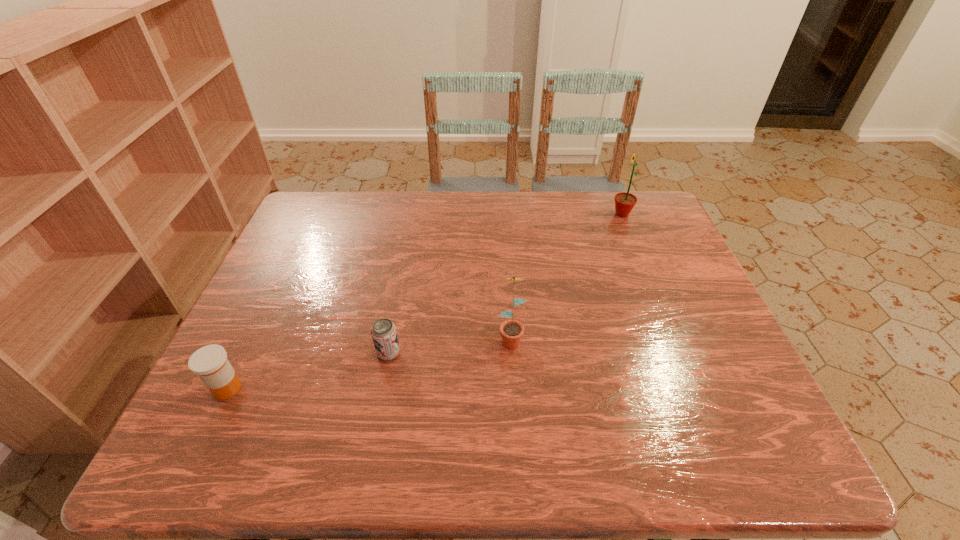
In order to click on free space located 0.160m on the flower of the third object from left to right in this screenshot , I will do `click(516, 417)`.

In order to click on vacant space located on the label of the nearest object in this screenshot , I will do `click(296, 388)`.

Where is `blank space located on the back of the second object from left to right`? Image resolution: width=960 pixels, height=540 pixels. blank space located on the back of the second object from left to right is located at coordinates (403, 275).

At what (x,y) coordinates should I click in order to perform the action: click on object that is positioned at the far edge. Please return your answer as a coordinate pair (x, y). This screenshot has height=540, width=960. Looking at the image, I should click on (624, 202).

The image size is (960, 540). I want to click on object that is at the left edge, so click(x=210, y=363).

Image resolution: width=960 pixels, height=540 pixels. Identify the location of object positioned at the right edge. (624, 202).

Where is `object at the far right corner`? The image size is (960, 540). object at the far right corner is located at coordinates (624, 202).

Locate an element on the screen. vacant space at the far edge is located at coordinates (382, 228).

Where is `vacant space at the near edge of the desktop`? Image resolution: width=960 pixels, height=540 pixels. vacant space at the near edge of the desktop is located at coordinates (329, 464).

Where is `vacant space at the left edge of the desktop`? The image size is (960, 540). vacant space at the left edge of the desktop is located at coordinates (286, 339).